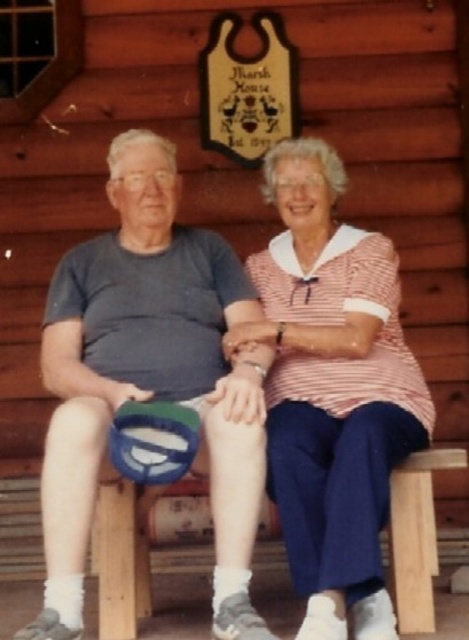
Question: Is matte gray t-shirt at center positioned behind pink striped shirt at center?

Choices:
 (A) yes
 (B) no

Answer: (A)

Question: Can you confirm if matte gray t-shirt at center is positioned to the left of pink striped shirt at center?

Choices:
 (A) no
 (B) yes

Answer: (B)

Question: Which point is farther to the camera?

Choices:
 (A) (82, 604)
 (B) (289, 211)

Answer: (B)

Question: Can you confirm if matte gray t-shirt at center is wider than pink striped shirt at center?

Choices:
 (A) no
 (B) yes

Answer: (B)

Question: Among these objects, which one is nearest to the camera?

Choices:
 (A) matte gray t-shirt at center
 (B) pink striped shirt at center

Answer: (B)

Question: Which point is farther from the camera taking this photo?

Choices:
 (A) (74, 611)
 (B) (310, 531)

Answer: (B)